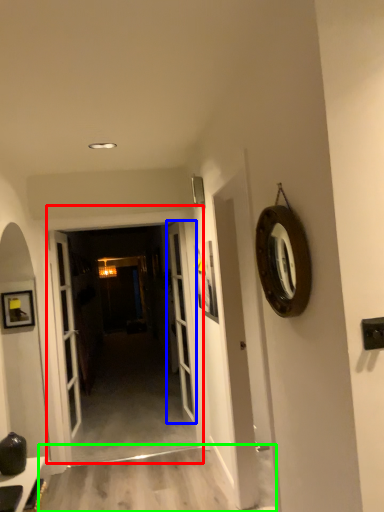
Question: Based on their relative distances, which object is farther from door (highlighted by a red box)? Choose from door (highlighted by a blue box) and path (highlighted by a green box).

Choices:
 (A) door
 (B) path

Answer: (B)